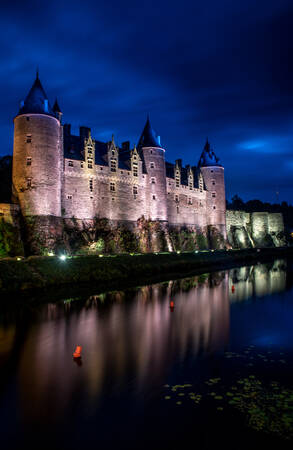
Locate an element on the screen. This screenshot has width=293, height=450. light is located at coordinates (62, 257), (166, 249), (243, 237), (252, 242), (277, 243).